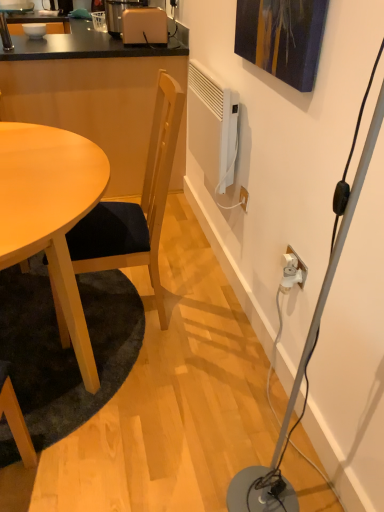
The image size is (384, 512). I want to click on empty space that is to the right of light brown wooden table at lower left, so click(210, 365).